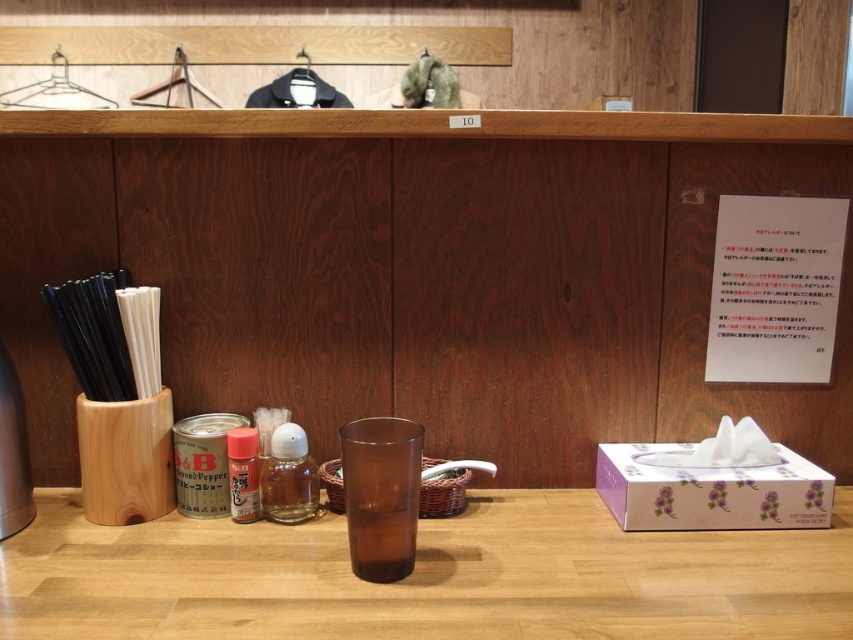
You are a barista preparing a drink and need to place both the translucent glass bottle at center and the translucent plastic bottle at center on a shelf that can only hold items spaced 1 inch apart. Will the bottles fit on the shelf?

The distance between the translucent glass bottle at center and the translucent plastic bottle at center is 1.01 inches, which is slightly more than the 1 inch requirement. Therefore, the bottles will not fit on the shelf as they exceed the spacing limit.

You are a customer at this counter and want to grab the larger bottle between the translucent glass bottle at center and the translucent plastic bottle at center. Which one should you choose?

The translucent glass bottle at center is larger than the translucent plastic bottle at center, so you should choose the translucent glass bottle at center.